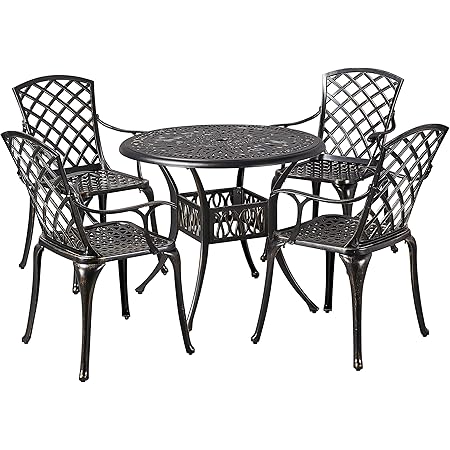
You are a GUI agent. You are given a task and a screenshot of the screen. Output one action in this format:
    pyautogui.click(x=<x>, y=<y>)
    Task: Click on the hole in middle of table
    The height and width of the screenshot is (450, 450).
    Given the screenshot: What is the action you would take?
    pyautogui.click(x=221, y=138)